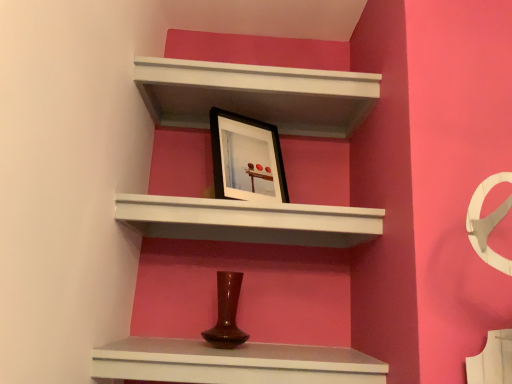
Question: From the image's perspective, does matte brown vase at center, arranged as the 1th shelf when ordered from the bottom, appear higher than white matte shelf at upper center, placed as the 2th shelf when sorted from bottom to top?

Choices:
 (A) yes
 (B) no

Answer: (B)

Question: Is matte brown vase at center, arranged as the 1th shelf when ordered from the bottom, aimed at white matte shelf at upper center, arranged as the 2th shelf when viewed from the top?

Choices:
 (A) no
 (B) yes

Answer: (A)

Question: Is matte brown vase at center, which appears as the third shelf when viewed from the top, in front of white matte shelf at upper center, arranged as the 2th shelf when viewed from the top?

Choices:
 (A) yes
 (B) no

Answer: (A)

Question: Considering the relative sizes of matte brown vase at center, which appears as the third shelf when viewed from the top, and white matte shelf at upper center, placed as the 2th shelf when sorted from bottom to top, in the image provided, is matte brown vase at center, which appears as the third shelf when viewed from the top, bigger than white matte shelf at upper center, placed as the 2th shelf when sorted from bottom to top,?

Choices:
 (A) no
 (B) yes

Answer: (A)

Question: Is white matte shelf at upper center, placed as the 2th shelf when sorted from bottom to top, completely or partially inside matte brown vase at center, arranged as the 1th shelf when ordered from the bottom?

Choices:
 (A) no
 (B) yes

Answer: (A)

Question: Can you confirm if matte brown vase at center, arranged as the 1th shelf when ordered from the bottom, is smaller than white matte shelf at upper center, placed as the 2th shelf when sorted from bottom to top?

Choices:
 (A) no
 (B) yes

Answer: (B)

Question: Is black matte picture frame at upper center shorter than white matte shelf at upper center, arranged as the 2th shelf when viewed from the top?

Choices:
 (A) yes
 (B) no

Answer: (B)

Question: Is black matte picture frame at upper center to the left of white matte shelf at upper center, arranged as the 2th shelf when viewed from the top, from the viewer's perspective?

Choices:
 (A) yes
 (B) no

Answer: (A)

Question: Is black matte picture frame at upper center to the right of white matte shelf at upper center, arranged as the 2th shelf when viewed from the top, from the viewer's perspective?

Choices:
 (A) no
 (B) yes

Answer: (A)

Question: Does black matte picture frame at upper center have a greater height compared to white matte shelf at upper center, placed as the 2th shelf when sorted from bottom to top?

Choices:
 (A) yes
 (B) no

Answer: (A)

Question: Does black matte picture frame at upper center have a smaller size compared to white matte shelf at upper center, placed as the 2th shelf when sorted from bottom to top?

Choices:
 (A) no
 (B) yes

Answer: (B)

Question: From the image's perspective, is black matte picture frame at upper center above white matte shelf at upper center, arranged as the 2th shelf when viewed from the top?

Choices:
 (A) no
 (B) yes

Answer: (B)

Question: Is matte brown vase at center, which appears as the third shelf when viewed from the top, completely or partially inside white matte shelf at upper center, arranged as the 2th shelf when viewed from the top?

Choices:
 (A) yes
 (B) no

Answer: (B)